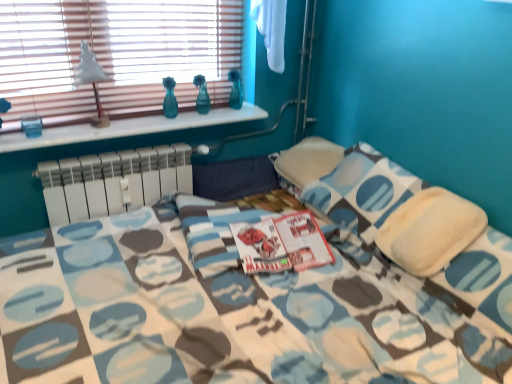
Question: Would you say white plastic radiator at center is a long distance from wooden blinds at upper left?

Choices:
 (A) no
 (B) yes

Answer: (A)

Question: Are white plastic radiator at center and wooden blinds at upper left beside each other?

Choices:
 (A) yes
 (B) no

Answer: (B)

Question: Is white plastic radiator at center bigger than wooden blinds at upper left?

Choices:
 (A) yes
 (B) no

Answer: (A)

Question: Could you tell me if white plastic radiator at center is facing wooden blinds at upper left?

Choices:
 (A) no
 (B) yes

Answer: (A)

Question: Can you confirm if white plastic radiator at center is smaller than wooden blinds at upper left?

Choices:
 (A) no
 (B) yes

Answer: (A)

Question: Can you confirm if white plastic radiator at center is positioned to the right of wooden blinds at upper left?

Choices:
 (A) no
 (B) yes

Answer: (A)

Question: Is wooden blinds at upper left at the left side of soft white pillow at center?

Choices:
 (A) yes
 (B) no

Answer: (A)

Question: Can you confirm if wooden blinds at upper left is taller than soft white pillow at center?

Choices:
 (A) yes
 (B) no

Answer: (B)

Question: From the image's perspective, does wooden blinds at upper left appear higher than soft white pillow at center?

Choices:
 (A) no
 (B) yes

Answer: (B)

Question: From a real-world perspective, is wooden blinds at upper left located higher than soft white pillow at center?

Choices:
 (A) no
 (B) yes

Answer: (B)

Question: Can you confirm if wooden blinds at upper left is wider than soft white pillow at center?

Choices:
 (A) no
 (B) yes

Answer: (A)

Question: Is there a large distance between wooden blinds at upper left and soft white pillow at center?

Choices:
 (A) no
 (B) yes

Answer: (B)

Question: Does white marble window sill at upper left have a greater width compared to white matte table lamp at upper left?

Choices:
 (A) yes
 (B) no

Answer: (A)